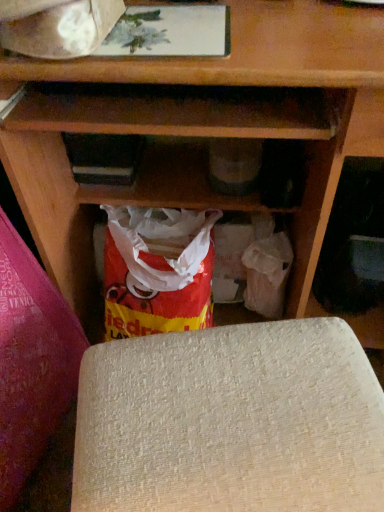
Question: Is beige textured yoga mat at lower left, placed as the first yoga mat when sorted from left to right, next to white paper at upper left and touching it?

Choices:
 (A) yes
 (B) no

Answer: (B)

Question: Is beige textured yoga mat at lower left, placed as the first yoga mat when sorted from left to right, bigger than white paper at upper left?

Choices:
 (A) yes
 (B) no

Answer: (A)

Question: Is beige textured yoga mat at lower left, the 2th yoga mat from the right, closer to the viewer compared to white paper at upper left?

Choices:
 (A) yes
 (B) no

Answer: (A)

Question: From the image's perspective, would you say beige textured yoga mat at lower left, placed as the first yoga mat when sorted from left to right, is positioned over white paper at upper left?

Choices:
 (A) yes
 (B) no

Answer: (B)

Question: From a real-world perspective, is beige textured yoga mat at lower left, the 2th yoga mat from the right, on top of white paper at upper left?

Choices:
 (A) no
 (B) yes

Answer: (A)

Question: Is beige textured yoga mat at lower left, the 2th yoga mat from the right, taller or shorter than white paper at upper left?

Choices:
 (A) tall
 (B) short

Answer: (A)

Question: Considering their positions, is beige textured yoga mat at lower left, placed as the first yoga mat when sorted from left to right, located in front of or behind white paper at upper left?

Choices:
 (A) behind
 (B) front

Answer: (B)

Question: Would you say beige textured yoga mat at lower left, the 2th yoga mat from the right, is inside or outside white paper at upper left?

Choices:
 (A) outside
 (B) inside

Answer: (A)

Question: From the image's perspective, relative to white paper at upper left, is beige textured yoga mat at lower left, the 2th yoga mat from the right, above or below?

Choices:
 (A) above
 (B) below

Answer: (B)

Question: Is beige textured yoga mat at lower left, placed as the first yoga mat when sorted from left to right, in front of or behind matte plastic grocery bag at lower right in the image?

Choices:
 (A) behind
 (B) front

Answer: (B)

Question: Based on their positions, is beige textured yoga mat at lower left, placed as the first yoga mat when sorted from left to right, located to the left or right of matte plastic grocery bag at lower right?

Choices:
 (A) left
 (B) right

Answer: (A)

Question: Is point (44, 394) closer or farther from the camera than point (264, 295)?

Choices:
 (A) closer
 (B) farther

Answer: (A)

Question: Considering the positions of beige textured yoga mat at lower left, placed as the first yoga mat when sorted from left to right, and matte plastic grocery bag at lower right in the image, is beige textured yoga mat at lower left, placed as the first yoga mat when sorted from left to right, bigger or smaller than matte plastic grocery bag at lower right?

Choices:
 (A) big
 (B) small

Answer: (A)

Question: From the image's perspective, relative to beige textured yoga mat at lower center, acting as the 2th yoga mat starting from the left, is white paper at upper left above or below?

Choices:
 (A) below
 (B) above

Answer: (B)

Question: From a real-world perspective, relative to beige textured yoga mat at lower center, the first yoga mat positioned from the right, is white paper at upper left vertically above or below?

Choices:
 (A) above
 (B) below

Answer: (A)